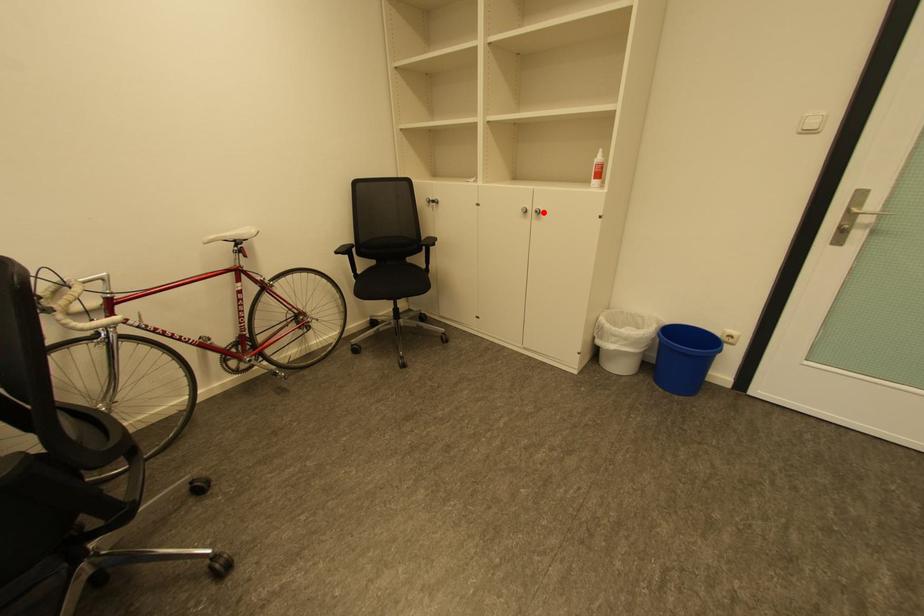
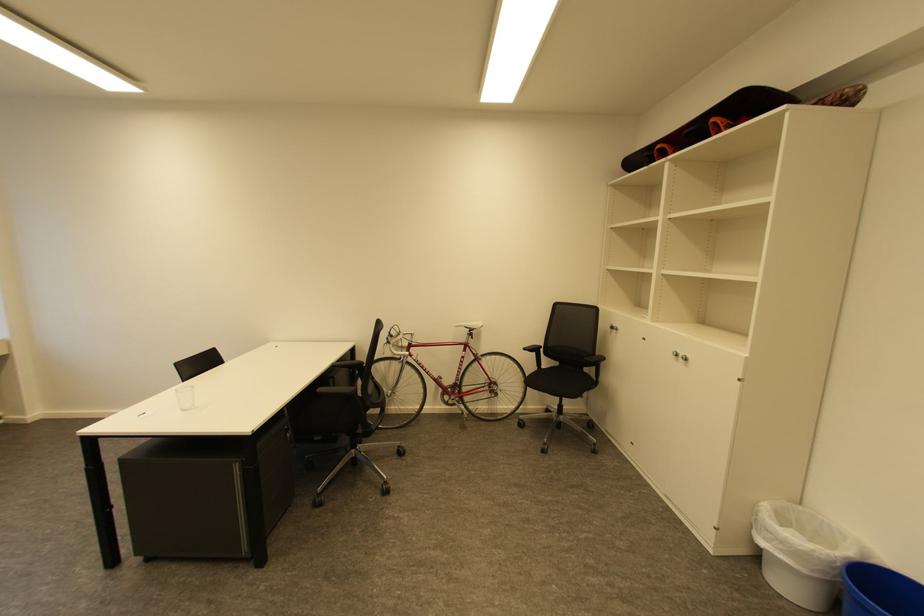
Where in the second image is the point corresponding to the highlighted location from the first image?

(689, 359)